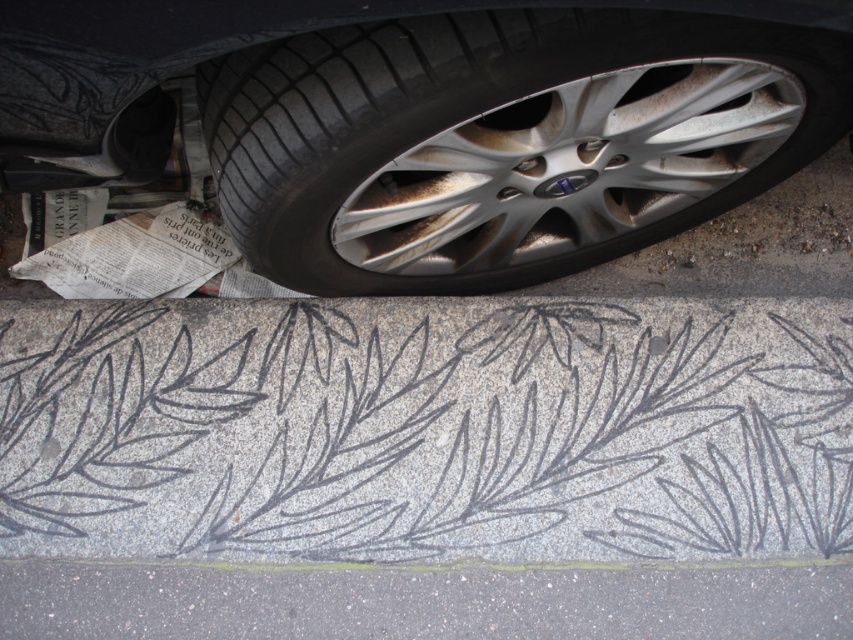
Question: Which point is farther from the camera taking this photo?

Choices:
 (A) [270, 566]
 (B) [305, 620]

Answer: (A)

Question: Is silver metallic wheel at center in front of granite curb at lower center?

Choices:
 (A) no
 (B) yes

Answer: (B)

Question: Can you confirm if gray asphalt at lower center is positioned above granite curb at lower center?

Choices:
 (A) no
 (B) yes

Answer: (A)

Question: Is silver metallic wheel at center below gray asphalt at lower center?

Choices:
 (A) no
 (B) yes

Answer: (A)

Question: Which object is positioned closest to the gray asphalt at lower center?

Choices:
 (A) granite curb at lower center
 (B) silver metallic wheel at center

Answer: (A)

Question: Which object is closer to the camera taking this photo?

Choices:
 (A) silver metallic wheel at center
 (B) granite curb at lower center

Answer: (A)